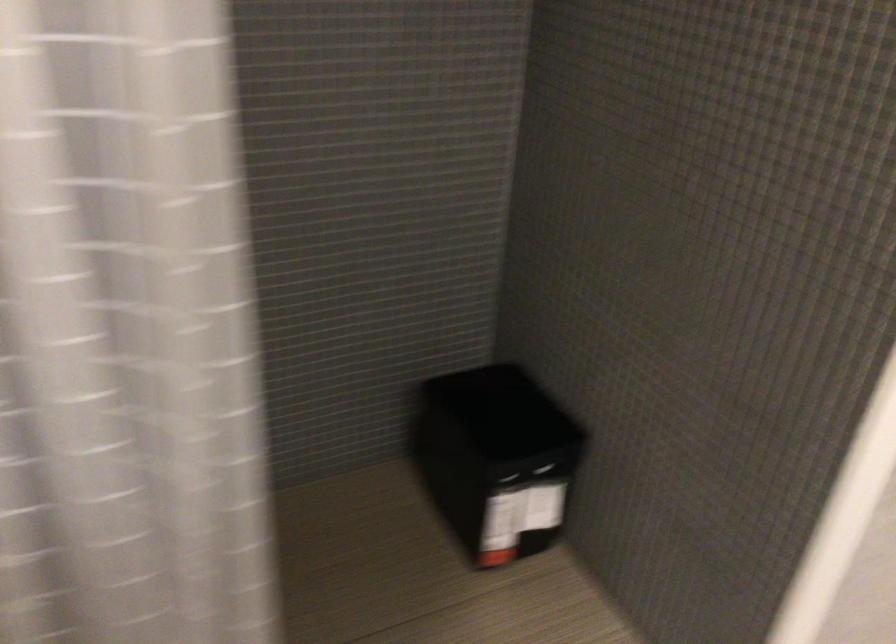
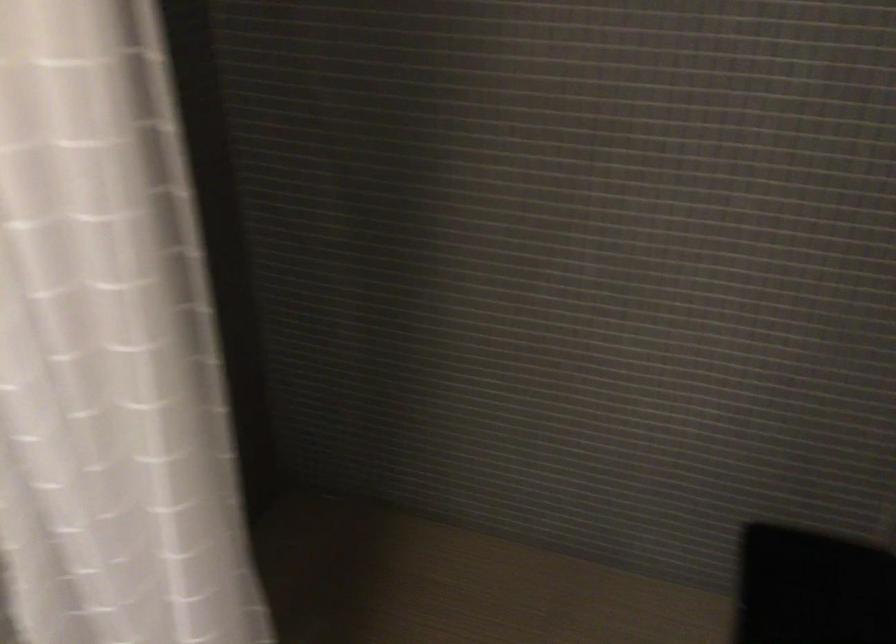
Question: The images are taken continuously from a first-person perspective. In which direction is your viewpoint rotating?

Choices:
 (A) Left
 (B) Right
 (C) Up
 (D) Down

Answer: (A)